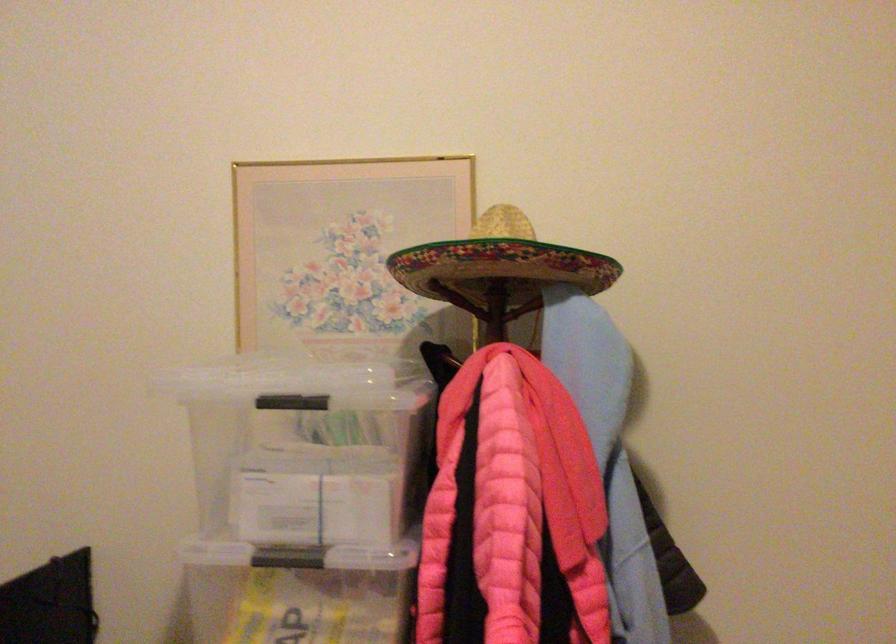
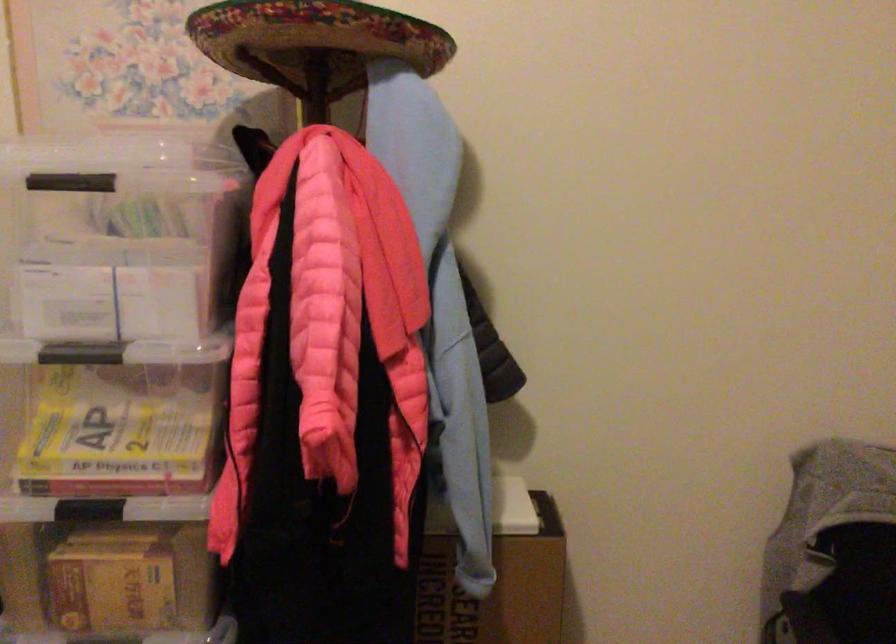
In the second image, find the point that corresponds to [289,402] in the first image.

(71, 181)